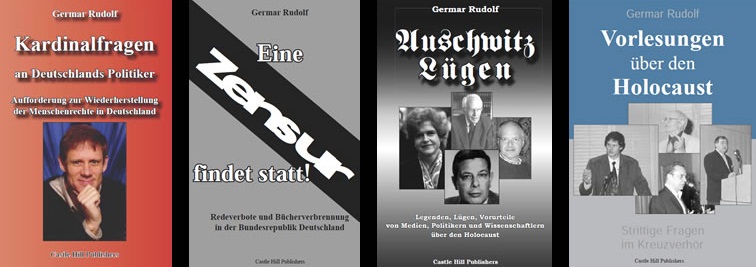
Locate an element on the screen. Image resolution: width=756 pixels, height=267 pixels. bottom-right corner of second book from left is located at coordinates pyautogui.click(x=354, y=259).